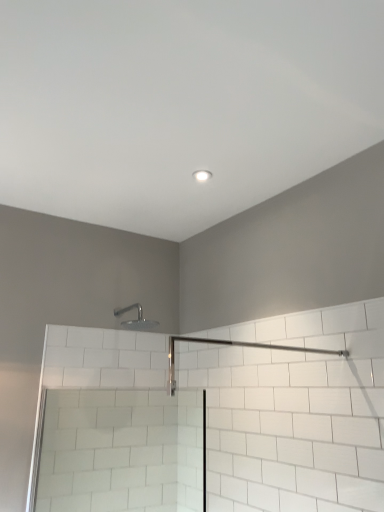
What do you see at coordinates (123, 451) in the screenshot?
I see `clear glass screen door at lower left` at bounding box center [123, 451].

At what (x,y) coordinates should I click in order to perform the action: click on clear glass screen door at lower left. Please return your answer as a coordinate pair (x, y). The image size is (384, 512). Looking at the image, I should click on (123, 451).

What is the approximate width of white glossy light fixture at upper center?

10.65 centimeters.

You are a GUI agent. You are given a task and a screenshot of the screen. Output one action in this format:
    pyautogui.click(x=<x>, y=<y>)
    Task: Click on the silver metallic shower head at upper center
    Image resolution: width=384 pixels, height=512 pixels.
    Given the screenshot: What is the action you would take?
    pyautogui.click(x=135, y=320)

Are clear glass screen door at lower left and silver metallic shower head at upper center located far from each other?

They are positioned close to each other.

Which of these two, clear glass screen door at lower left or silver metallic shower head at upper center, is smaller?

With smaller size is silver metallic shower head at upper center.

This screenshot has height=512, width=384. What are the coordinates of `screen door in front of the silver metallic shower head at upper center` in the screenshot? It's located at (123, 451).

In the scene shown: From the image's perspective, which one is positioned higher, clear glass screen door at lower left or silver metallic shower head at upper center?

silver metallic shower head at upper center appears higher in the image.

Looking at this image, can you tell me how much silver metallic shower head at upper center and white glossy light fixture at upper center differ in facing direction?

The facing directions of silver metallic shower head at upper center and white glossy light fixture at upper center are 4.51 degrees apart.

Which object is more forward, silver metallic shower head at upper center or white glossy light fixture at upper center?

white glossy light fixture at upper center is more forward.

Can you see silver metallic shower head at upper center touching white glossy light fixture at upper center?

No, silver metallic shower head at upper center is not in contact with white glossy light fixture at upper center.

Can you confirm if silver metallic shower head at upper center is thinner than white glossy light fixture at upper center?

Answer: Incorrect, the width of silver metallic shower head at upper center is not less than that of white glossy light fixture at upper center.

Would you say clear glass screen door at lower left is to the left or to the right of white glossy light fixture at upper center in the picture?

Based on their positions, clear glass screen door at lower left is located to the left of white glossy light fixture at upper center.

From a real-world perspective, is clear glass screen door at lower left under white glossy light fixture at upper center?

Yes, from a real-world perspective, clear glass screen door at lower left is beneath white glossy light fixture at upper center.

Can you confirm if clear glass screen door at lower left is bigger than white glossy light fixture at upper center?

Indeed, clear glass screen door at lower left has a larger size compared to white glossy light fixture at upper center.

From the image's perspective, is white glossy light fixture at upper center located above or below clear glass screen door at lower left?

white glossy light fixture at upper center is above clear glass screen door at lower left.

Is white glossy light fixture at upper center not within clear glass screen door at lower left?

white glossy light fixture at upper center is positioned outside clear glass screen door at lower left.

Is white glossy light fixture at upper center in front of or behind clear glass screen door at lower left in the image?

Visually, white glossy light fixture at upper center is located behind clear glass screen door at lower left.

Does white glossy light fixture at upper center appear on the right side of clear glass screen door at lower left?

Correct, you'll find white glossy light fixture at upper center to the right of clear glass screen door at lower left.

Locate an element on the screen. This screenshot has width=384, height=512. screen door below the silver metallic shower head at upper center (from the image's perspective) is located at coordinates (123, 451).

Do you think silver metallic shower head at upper center is within clear glass screen door at lower left, or outside of it?

silver metallic shower head at upper center is located beyond the bounds of clear glass screen door at lower left.

Is clear glass screen door at lower left at the back of silver metallic shower head at upper center?

No, silver metallic shower head at upper center's orientation is not away from clear glass screen door at lower left.

Considering the points (130, 322) and (190, 395), which point is in front, point (130, 322) or point (190, 395)?

The point (130, 322) is in front.

Would you say white glossy light fixture at upper center is inside or outside silver metallic shower head at upper center?

white glossy light fixture at upper center is spatially situated outside silver metallic shower head at upper center.

In terms of height, does white glossy light fixture at upper center look taller or shorter compared to silver metallic shower head at upper center?

Clearly, white glossy light fixture at upper center is shorter compared to silver metallic shower head at upper center.

Is white glossy light fixture at upper center far from silver metallic shower head at upper center?

They are positioned close to each other.

Is white glossy light fixture at upper center facing away from silver metallic shower head at upper center?

No.

At what (x,y) coordinates should I click in order to perform the action: click on screen door that is under the silver metallic shower head at upper center (from a real-world perspective). Please return your answer as a coordinate pair (x, y). This screenshot has height=512, width=384. Looking at the image, I should click on click(123, 451).

Find the location of a particular element. light fixture above the silver metallic shower head at upper center (from a real-world perspective) is located at coordinates (202, 175).

Looking at the image, which one is located closer to silver metallic shower head at upper center, white glossy light fixture at upper center or clear glass screen door at lower left?

The object closer to silver metallic shower head at upper center is clear glass screen door at lower left.

Looking at this image, which object lies further to the anchor point white glossy light fixture at upper center, silver metallic shower head at upper center or clear glass screen door at lower left?

clear glass screen door at lower left is further to white glossy light fixture at upper center.

Which object lies further to the anchor point clear glass screen door at lower left, white glossy light fixture at upper center or silver metallic shower head at upper center?

white glossy light fixture at upper center is further to clear glass screen door at lower left.

From the image, which object appears to be nearer to clear glass screen door at lower left, silver metallic shower head at upper center or white glossy light fixture at upper center?

Among the two, silver metallic shower head at upper center is located nearer to clear glass screen door at lower left.

Based on their spatial positions, is clear glass screen door at lower left or silver metallic shower head at upper center closer to white glossy light fixture at upper center?

Among the two, silver metallic shower head at upper center is located nearer to white glossy light fixture at upper center.

Based on their spatial positions, is clear glass screen door at lower left or white glossy light fixture at upper center closer to silver metallic shower head at upper center?

clear glass screen door at lower left.

Locate an element on the screen. The image size is (384, 512). light fixture between clear glass screen door at lower left and silver metallic shower head at upper center in the front-back direction is located at coordinates (202, 175).